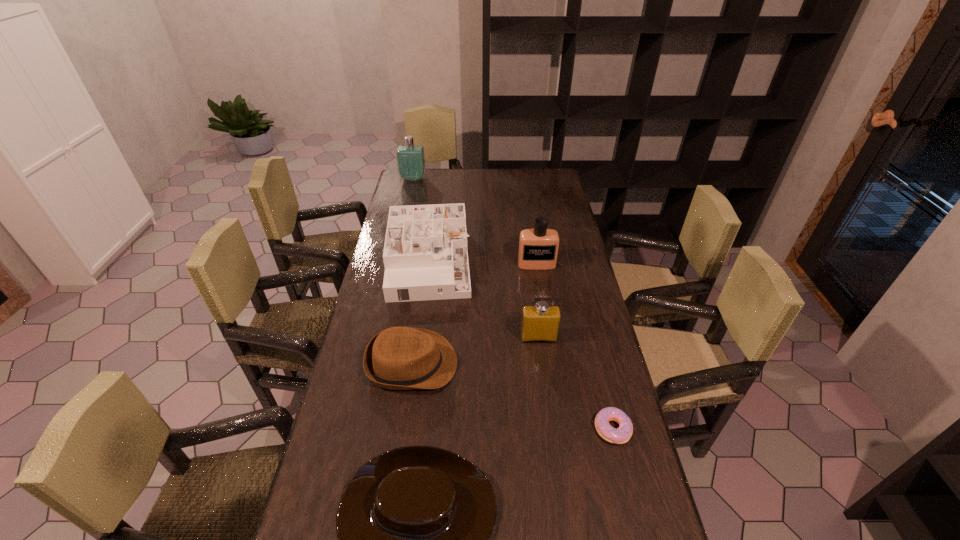
I want to click on free space at the far edge, so click(x=521, y=177).

Image resolution: width=960 pixels, height=540 pixels. Identify the location of vacant space at the left edge of the desktop. (420, 201).

In the image, there is a desktop. Identify the location of blank space at the right edge. (593, 347).

This screenshot has height=540, width=960. Identify the location of vacant space at the far right corner of the desktop. 533,174.

Where is `free point between the fifth tallest object and the second nearest perfume`? This screenshot has height=540, width=960. free point between the fifth tallest object and the second nearest perfume is located at coordinates tap(474, 314).

Find the location of a particular element. This screenshot has width=960, height=540. vacant space that is in between the farthest object and the second nearest perfume is located at coordinates (475, 221).

Where is `vacant point located between the nearest perfume and the rightmost object`? vacant point located between the nearest perfume and the rightmost object is located at coordinates 576,383.

At what (x,y) coordinates should I click in order to perform the action: click on blank region between the farthest object and the sixth farthest object. Please return your answer as a coordinate pair (x, y). This screenshot has width=960, height=540. Looking at the image, I should click on (513, 304).

You are a GUI agent. You are given a task and a screenshot of the screen. Output one action in this format:
    pyautogui.click(x=<x>, y=<y>)
    Task: Click on the free space between the nearest perfume and the farthest perfume
    This screenshot has height=540, width=960.
    Given the screenshot: What is the action you would take?
    pyautogui.click(x=476, y=259)

Find the location of a particular element. This screenshot has width=960, height=540. vacant region between the nearest perfume and the second nearest object is located at coordinates (576, 383).